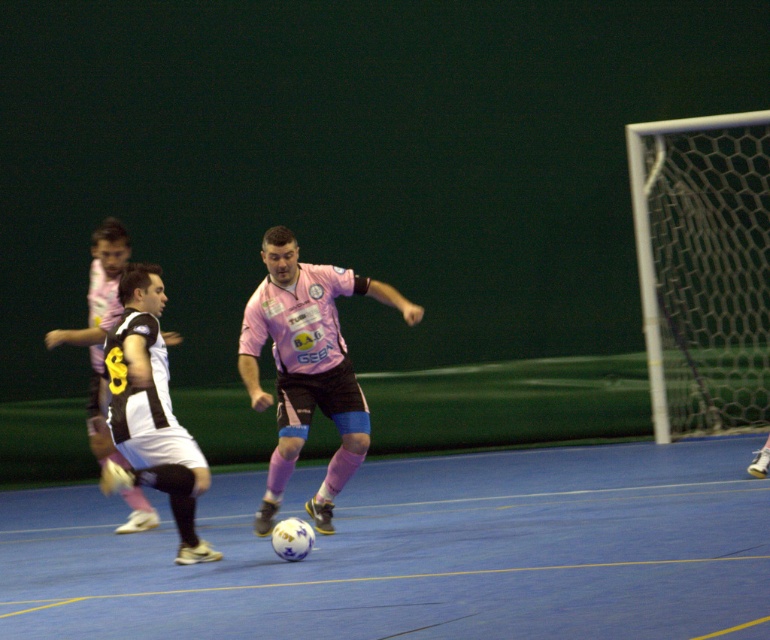
Question: Estimate the real-world distances between objects in this image. Which object is farther from the white matte jersey at center?

Choices:
 (A) blue synthetic floor at center
 (B) pink matte jersey at center

Answer: (A)

Question: Which object is positioned closest to the black and white jersey at left?

Choices:
 (A) blue synthetic floor at center
 (B) pink matte jersey at center

Answer: (B)

Question: Can you confirm if pink matte jersey at center is wider than black and white jersey at left?

Choices:
 (A) no
 (B) yes

Answer: (B)

Question: Does white matte jersey at center appear over black and white jersey at left?

Choices:
 (A) yes
 (B) no

Answer: (B)

Question: Estimate the real-world distances between objects in this image. Which object is closer to the white matte jersey at center?

Choices:
 (A) blue synthetic floor at center
 (B) pink matte jersey at center
 (C) black and white jersey at left

Answer: (B)

Question: Is blue synthetic floor at center further to camera compared to black and white jersey at left?

Choices:
 (A) no
 (B) yes

Answer: (A)